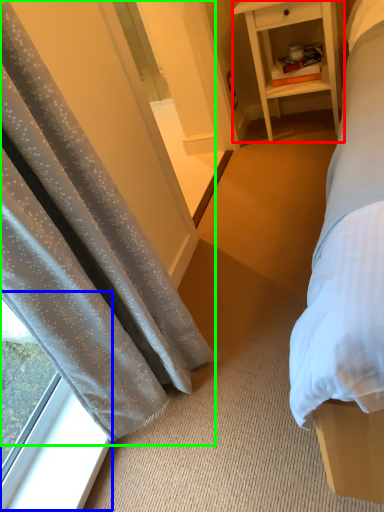
Question: Which object is the closest to the nightstand (highlighted by a red box)? Choose among these: window (highlighted by a blue box) or curtain (highlighted by a green box).

Choices:
 (A) window
 (B) curtain

Answer: (B)